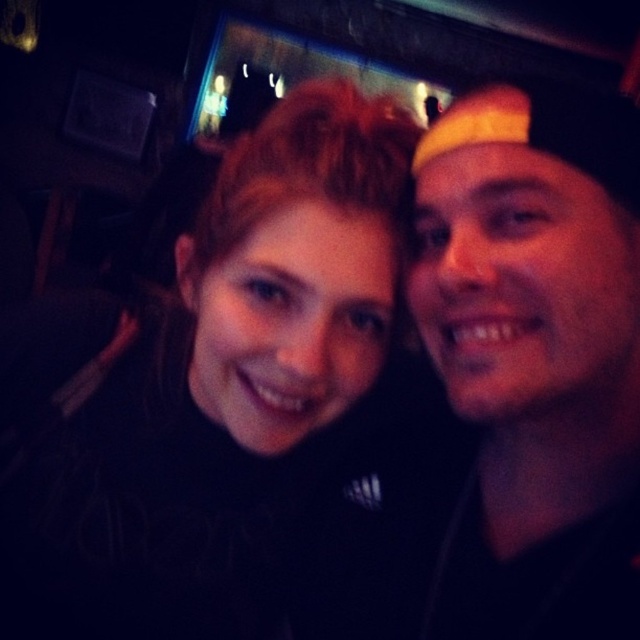
Locate an element on the screen. The height and width of the screenshot is (640, 640). black matte hair at center is located at coordinates (202, 381).

Can you confirm if black matte hair at center is smaller than yellow fabric cap at right?

No.

Locate an element on the screen. This screenshot has height=640, width=640. black matte hair at center is located at coordinates (202, 381).

The width and height of the screenshot is (640, 640). What are the coordinates of `black matte hair at center` in the screenshot? It's located at click(x=202, y=381).